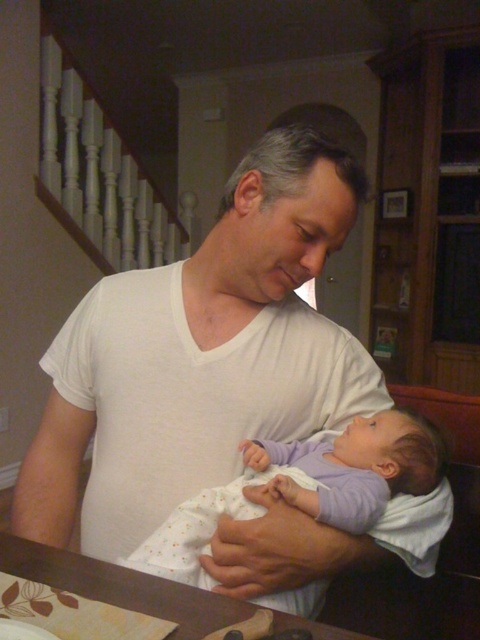
Does white soft shirt at center have a greater height compared to purple soft fabric baby at center?

Yes.

Measure the distance from white soft shirt at center to purple soft fabric baby at center.

white soft shirt at center is 5.47 inches away from purple soft fabric baby at center.

Is point (113, 513) more distant than point (146, 570)?

Yes, point (113, 513) is farther from viewer.

Find the location of a particular element. The width and height of the screenshot is (480, 640). white soft shirt at center is located at coordinates click(x=200, y=356).